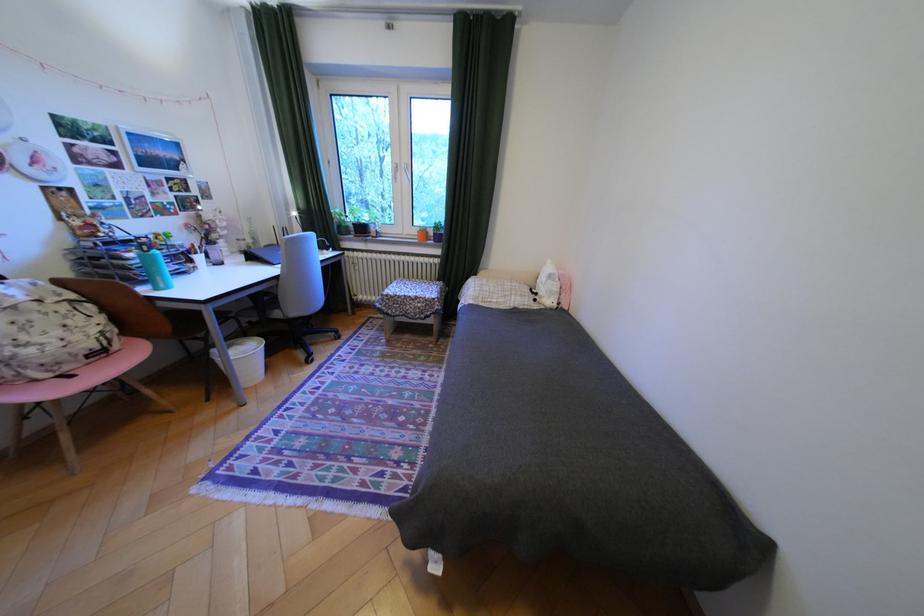
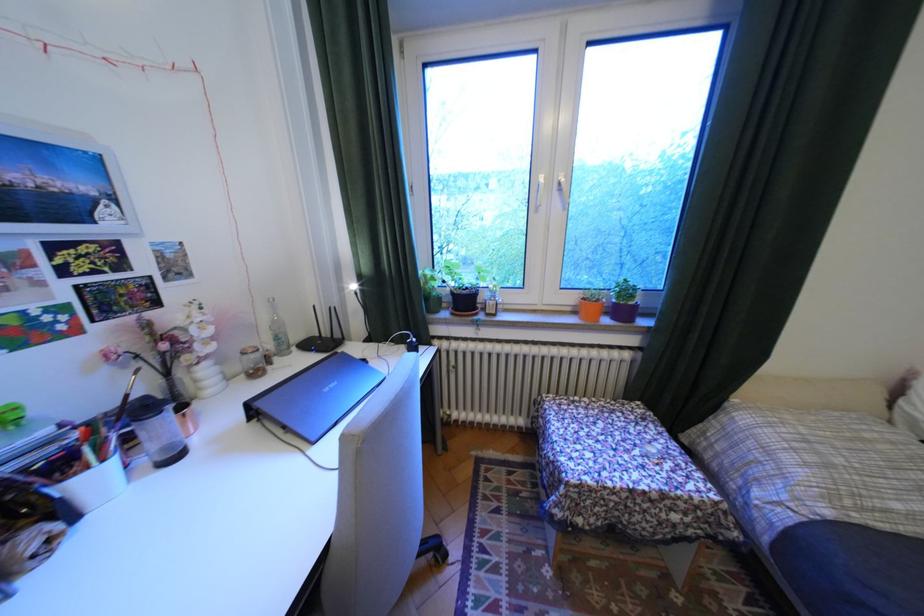
Find the pixel in the second image that matches the point at 359,227 in the first image.

(451, 299)